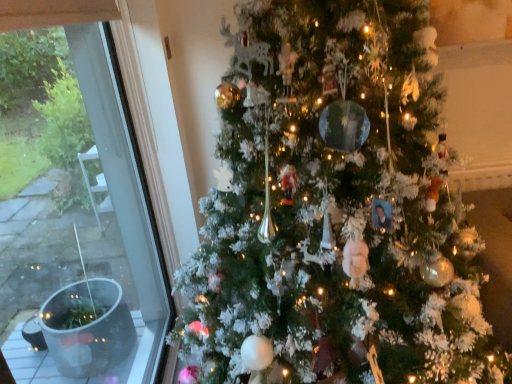
Question: Is white frosted christmas tree at center bigger or smaller than transparent glass window at left?

Choices:
 (A) small
 (B) big

Answer: (B)

Question: From a real-world perspective, is white frosted christmas tree at center positioned above or below transparent glass window at left?

Choices:
 (A) below
 (B) above

Answer: (B)

Question: Based on their positions, is white frosted christmas tree at center located to the left or right of transparent glass window at left?

Choices:
 (A) left
 (B) right

Answer: (B)

Question: From a real-world perspective, is transparent glass window at left above or below white frosted christmas tree at center?

Choices:
 (A) below
 (B) above

Answer: (A)

Question: Considering the positions of transparent glass window at left and white frosted christmas tree at center in the image, is transparent glass window at left bigger or smaller than white frosted christmas tree at center?

Choices:
 (A) big
 (B) small

Answer: (B)

Question: In terms of height, does transparent glass window at left look taller or shorter compared to white frosted christmas tree at center?

Choices:
 (A) short
 (B) tall

Answer: (A)

Question: Considering the positions of transparent glass window at left and white frosted christmas tree at center in the image, is transparent glass window at left wider or thinner than white frosted christmas tree at center?

Choices:
 (A) thin
 (B) wide

Answer: (A)